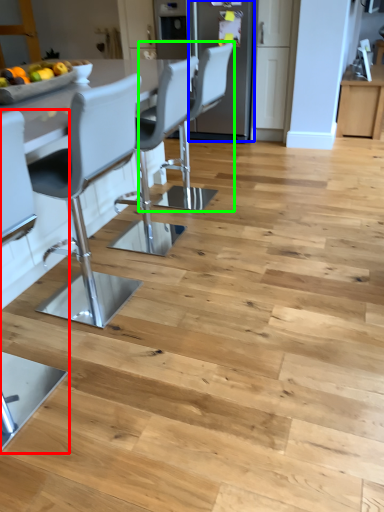
Question: Considering the real-world distances, which object is closest to chair (highlighted by a red box)? appliance (highlighted by a blue box) or chair (highlighted by a green box).

Choices:
 (A) appliance
 (B) chair

Answer: (B)